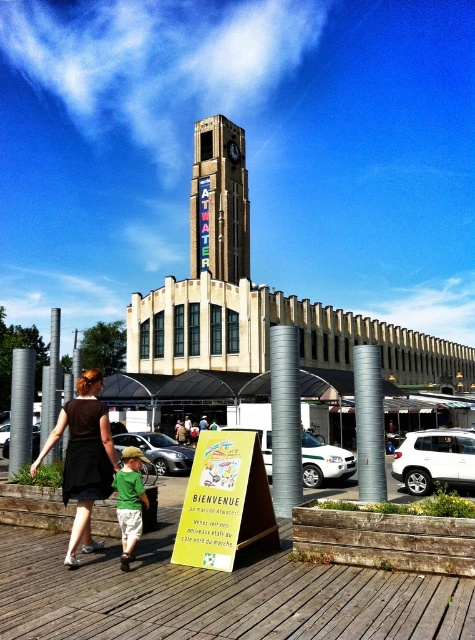
You are standing at the camera position looking at the scene. Which object is located at the coordinates point (130, 500)?

The green cotton shirt at lower left is located at point (130, 500).

You are a photographer positioned at the camera location. You want to capture a photo that includes both the matte black dress at center and the green cotton shirt at lower left. What is the minimum distance you need to adjust your camera angle to ensure both subjects are in frame?

The matte black dress at center and green cotton shirt at lower left are 2.03 meters apart. To capture both in the frame, the photographer must adjust the camera angle to cover at least 2.03 meters between them.